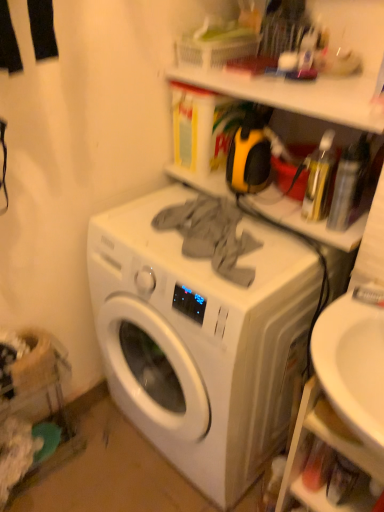
Question: Is matte plastic shelf at upper center, which is counted as the second shelf, starting from the bottom, to the right of white matte washing machine at center from the viewer's perspective?

Choices:
 (A) no
 (B) yes

Answer: (B)

Question: Are matte plastic shelf at upper center, which is counted as the second shelf, starting from the bottom, and white matte washing machine at center beside each other?

Choices:
 (A) no
 (B) yes

Answer: (A)

Question: Is matte plastic shelf at upper center, which is counted as the second shelf, starting from the bottom, aimed at white matte washing machine at center?

Choices:
 (A) no
 (B) yes

Answer: (A)

Question: From the image's perspective, is matte plastic shelf at upper center, the 2th shelf positioned from the top, located above white matte washing machine at center?

Choices:
 (A) no
 (B) yes

Answer: (B)

Question: From a real-world perspective, is matte plastic shelf at upper center, the 2th shelf positioned from the top, located higher than white matte washing machine at center?

Choices:
 (A) yes
 (B) no

Answer: (A)

Question: From a real-world perspective, is matte plastic shelf at upper center, which is counted as the second shelf, starting from the bottom, beneath white matte washing machine at center?

Choices:
 (A) no
 (B) yes

Answer: (A)

Question: Considering the relative positions of matte plastic shelf at upper center, the 2th shelf positioned from the top, and white plastic shelf at lower right, the 3th shelf viewed from the top, in the image provided, is matte plastic shelf at upper center, the 2th shelf positioned from the top, to the right of white plastic shelf at lower right, the 3th shelf viewed from the top, from the viewer's perspective?

Choices:
 (A) no
 (B) yes

Answer: (A)

Question: Can you confirm if matte plastic shelf at upper center, which is counted as the second shelf, starting from the bottom, is bigger than white plastic shelf at lower right, the 3th shelf viewed from the top?

Choices:
 (A) no
 (B) yes

Answer: (A)

Question: From the image's perspective, would you say matte plastic shelf at upper center, which is counted as the second shelf, starting from the bottom, is positioned over white plastic shelf at lower right, arranged as the 1th shelf when ordered from the bottom?

Choices:
 (A) yes
 (B) no

Answer: (A)

Question: Considering the relative positions of matte plastic shelf at upper center, which is counted as the second shelf, starting from the bottom, and white plastic shelf at lower right, the 3th shelf viewed from the top, in the image provided, is matte plastic shelf at upper center, which is counted as the second shelf, starting from the bottom, in front of white plastic shelf at lower right, the 3th shelf viewed from the top,?

Choices:
 (A) yes
 (B) no

Answer: (B)

Question: Can you confirm if matte plastic shelf at upper center, the 2th shelf positioned from the top, is smaller than white plastic shelf at lower right, arranged as the 1th shelf when ordered from the bottom?

Choices:
 (A) no
 (B) yes

Answer: (B)

Question: From the image's perspective, is matte plastic shelf at upper center, which is counted as the second shelf, starting from the bottom, located beneath white plastic shelf at lower right, arranged as the 1th shelf when ordered from the bottom?

Choices:
 (A) yes
 (B) no

Answer: (B)

Question: Considering the relative sizes of white plastic shelf at lower right, the 3th shelf viewed from the top, and matte plastic shelf at upper center, the 2th shelf positioned from the top, in the image provided, is white plastic shelf at lower right, the 3th shelf viewed from the top, shorter than matte plastic shelf at upper center, the 2th shelf positioned from the top,?

Choices:
 (A) yes
 (B) no

Answer: (B)